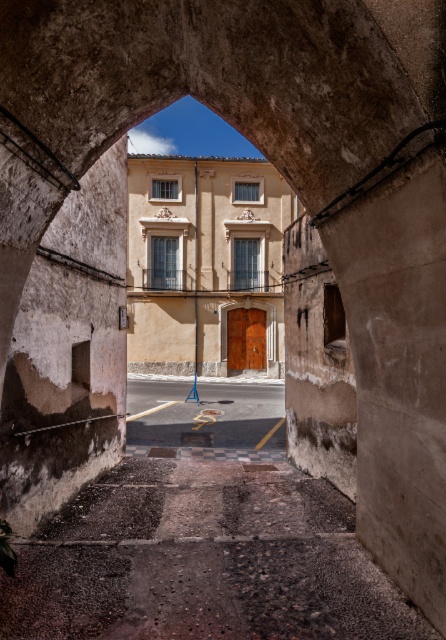
Does smooth asphalt road at center have a greater height compared to brown wooden door at center?

In fact, smooth asphalt road at center may be shorter than brown wooden door at center.

Where is `smooth asphalt road at center`? This screenshot has width=446, height=640. smooth asphalt road at center is located at coordinates (205, 413).